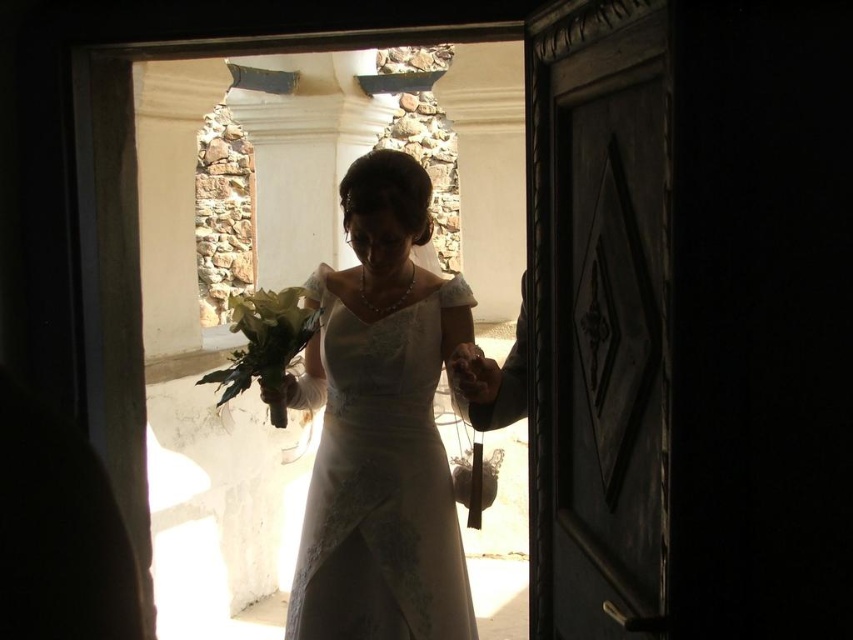
Does white satin dress at center appear under green leafy bouquet at center?

Indeed, white satin dress at center is positioned under green leafy bouquet at center.

Is white satin dress at center above green leafy bouquet at center?

Actually, white satin dress at center is below green leafy bouquet at center.

Which is in front, point (368, 524) or point (270, 352)?

Point (368, 524) is more forward.

Where is `white satin dress at center`? white satin dress at center is located at coordinates (380, 426).